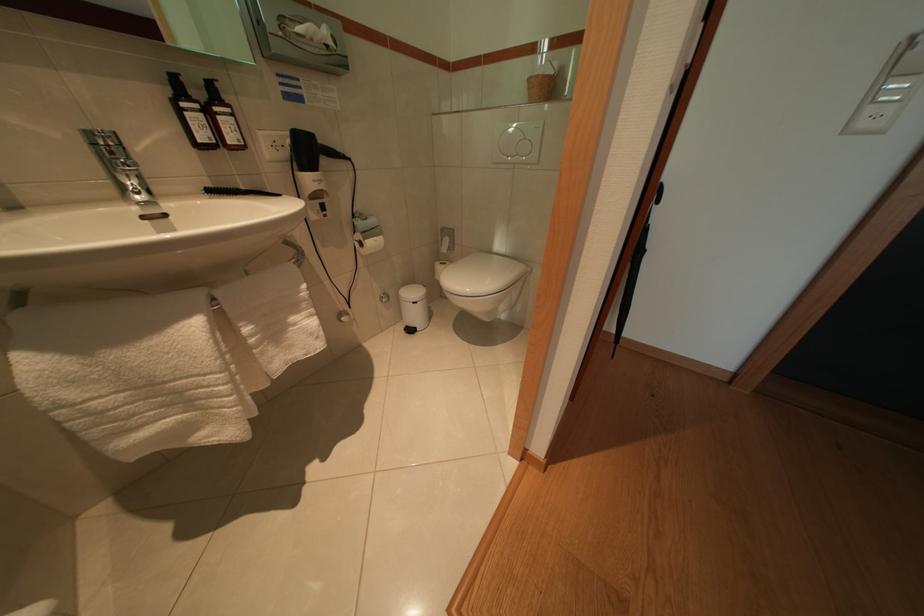
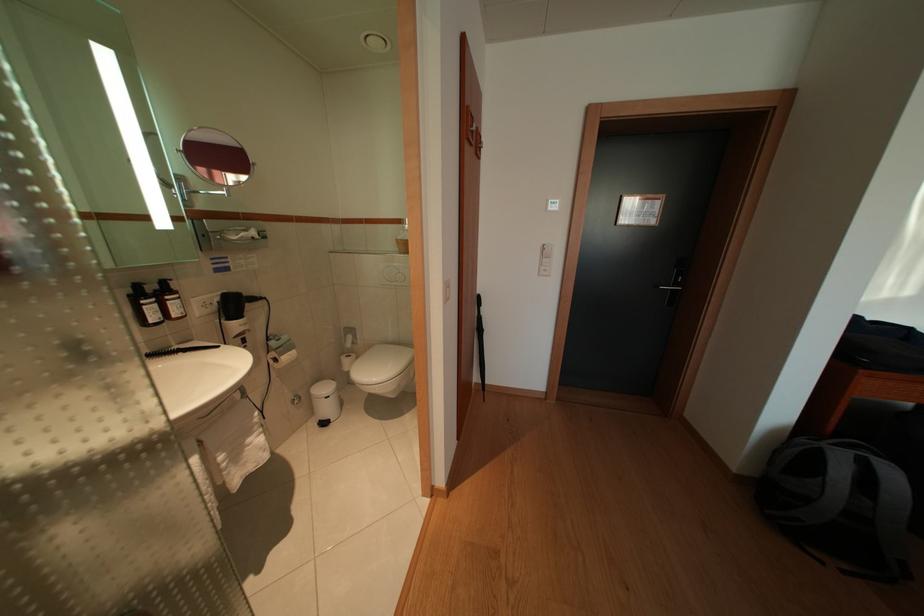
Question: What movement of the cameraman would produce the second image?

Choices:
 (A) Left
 (B) Right
 (C) Forward
 (D) Backward

Answer: (D)